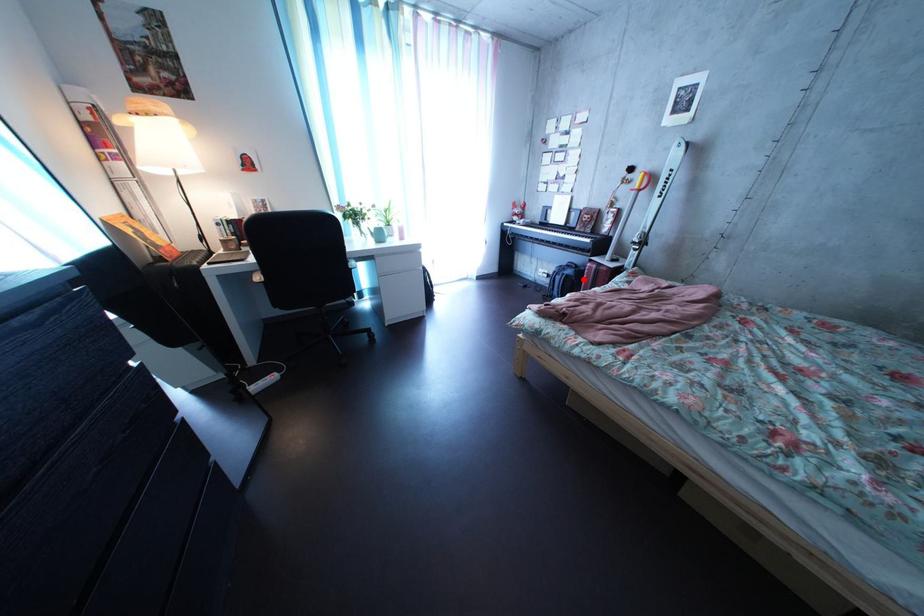
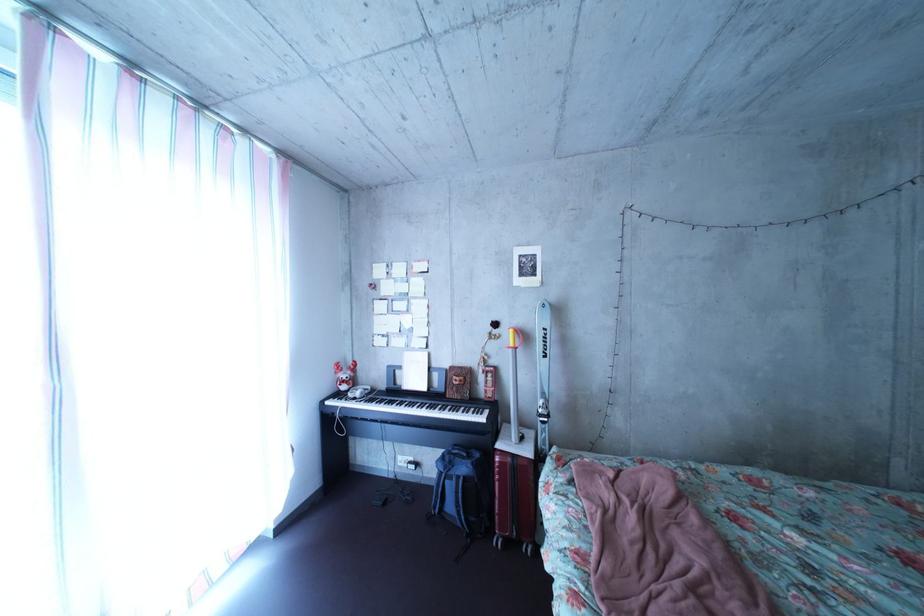
Question: I am providing you with two images of the same scene from different viewpoints. A red point is marked on the first image. Is the red point's position out of view in image 2?

Choices:
 (A) Yes
 (B) No

Answer: (B)